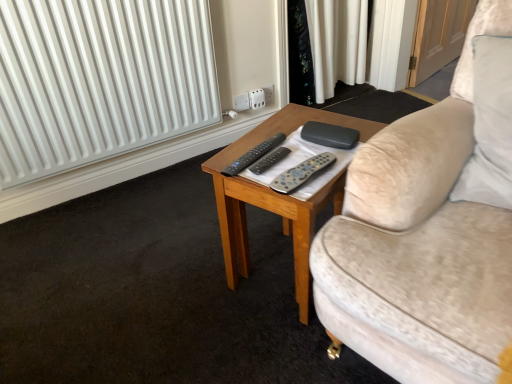
Locate an element on the screen. The height and width of the screenshot is (384, 512). free space to the back side of black matte remote control at center, which appears as the first remote control when viewed from the left is located at coordinates (264, 134).